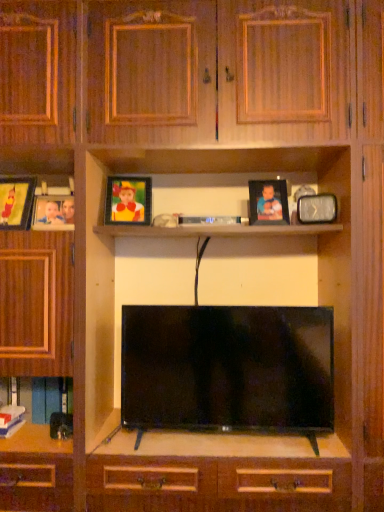
This screenshot has height=512, width=384. I want to click on blue paper book at lower left, which is counted as the 2th book, starting from the back, so click(x=11, y=420).

Where is `matte plastic picture frame at left, the second picture frame viewed from the left`? The image size is (384, 512). matte plastic picture frame at left, the second picture frame viewed from the left is located at coordinates (53, 213).

What do you see at coordinates (128, 200) in the screenshot?
I see `matte plastic picture frame at upper center, the 3th picture frame in the right-to-left sequence` at bounding box center [128, 200].

Find the location of a particular element. matte plastic picture frame at upper center, which appears as the third picture frame when viewed from the left is located at coordinates (128, 200).

Describe the element at coordinates (227, 368) in the screenshot. I see `black glossy flat-screen tv at center` at that location.

Where is `matte black picture frame at upper center, the fourth picture frame positioned from the left`? matte black picture frame at upper center, the fourth picture frame positioned from the left is located at coordinates (268, 202).

The height and width of the screenshot is (512, 384). What do you see at coordinates (268, 202) in the screenshot?
I see `matte black picture frame at upper center, positioned as the second picture frame in right-to-left order` at bounding box center [268, 202].

What are the coordinates of `blue paper book at lower left, which appears as the first book when viewed from the front` in the screenshot? It's located at (11, 420).

How different are the orientations of metallic rectangular clock at upper right, placed as the first picture frame when sorted from right to left, and matte plastic picture frame at upper center, which appears as the third picture frame when viewed from the left, in degrees?

The angle between the facing direction of metallic rectangular clock at upper right, placed as the first picture frame when sorted from right to left, and the facing direction of matte plastic picture frame at upper center, which appears as the third picture frame when viewed from the left, is 23.5 degrees.

Is the surface of metallic rectangular clock at upper right, acting as the 5th picture frame starting from the left, in direct contact with matte plastic picture frame at upper center, the 3th picture frame in the right-to-left sequence?

metallic rectangular clock at upper right, acting as the 5th picture frame starting from the left, and matte plastic picture frame at upper center, the 3th picture frame in the right-to-left sequence, are not in contact.

Between metallic rectangular clock at upper right, acting as the 5th picture frame starting from the left, and matte plastic picture frame at upper center, which appears as the third picture frame when viewed from the left, which one has larger width?

With larger width is matte plastic picture frame at upper center, which appears as the third picture frame when viewed from the left.

Does matte plastic picture frame at left, the second picture frame viewed from the left, appear on the left side of matte black picture frame at upper center, the fourth picture frame positioned from the left?

Indeed, matte plastic picture frame at left, the second picture frame viewed from the left, is positioned on the left side of matte black picture frame at upper center, the fourth picture frame positioned from the left.

Considering the relative sizes of matte plastic picture frame at left, the fourth picture frame when ordered from right to left, and matte black picture frame at upper center, the fourth picture frame positioned from the left, in the image provided, is matte plastic picture frame at left, the fourth picture frame when ordered from right to left, smaller than matte black picture frame at upper center, the fourth picture frame positioned from the left,?

→ Yes, matte plastic picture frame at left, the fourth picture frame when ordered from right to left, is smaller than matte black picture frame at upper center, the fourth picture frame positioned from the left.

From the image's perspective, is matte plastic picture frame at left, the second picture frame viewed from the left, on matte black picture frame at upper center, the fourth picture frame positioned from the left?

Incorrect, from the image's perspective, matte plastic picture frame at left, the second picture frame viewed from the left, is lower than matte black picture frame at upper center, the fourth picture frame positioned from the left.

How different are the orientations of matte plastic picture frame at left, the fourth picture frame when ordered from right to left, and matte black picture frame at upper center, the fourth picture frame positioned from the left, in degrees?

6.83 degrees separate the facing orientations of matte plastic picture frame at left, the fourth picture frame when ordered from right to left, and matte black picture frame at upper center, the fourth picture frame positioned from the left.

Could you measure the distance between hardcover book at lower left, positioned as the 2th book in front-to-back order, and matte plastic picture frame at upper center, which appears as the third picture frame when viewed from the left?

The distance of hardcover book at lower left, positioned as the 2th book in front-to-back order, from matte plastic picture frame at upper center, which appears as the third picture frame when viewed from the left, is 70.53 centimeters.

Consider the image. Does hardcover book at lower left, positioned as the 2th book in front-to-back order, have a lesser height compared to matte plastic picture frame at upper center, the 3th picture frame in the right-to-left sequence?

Yes.

Is hardcover book at lower left, positioned as the 2th book in front-to-back order, not near matte plastic picture frame at upper center, the 3th picture frame in the right-to-left sequence?

hardcover book at lower left, positioned as the 2th book in front-to-back order, is near matte plastic picture frame at upper center, the 3th picture frame in the right-to-left sequence, not far away.

From a real-world perspective, between hardcover book at lower left, positioned as the 2th book in front-to-back order, and matte plastic picture frame at upper center, the 3th picture frame in the right-to-left sequence, who is vertically lower?

hardcover book at lower left, positioned as the 2th book in front-to-back order.

Do you think matte wooden picture frame at left, arranged as the first picture frame when viewed from the left, is within matte plastic picture frame at upper center, which appears as the third picture frame when viewed from the left, or outside of it?

matte wooden picture frame at left, arranged as the first picture frame when viewed from the left, is spatially situated outside matte plastic picture frame at upper center, which appears as the third picture frame when viewed from the left.

Considering the sizes of objects matte wooden picture frame at left, the fifth picture frame in the right-to-left sequence, and matte plastic picture frame at upper center, which appears as the third picture frame when viewed from the left, in the image provided, who is taller, matte wooden picture frame at left, the fifth picture frame in the right-to-left sequence, or matte plastic picture frame at upper center, which appears as the third picture frame when viewed from the left,?

matte wooden picture frame at left, the fifth picture frame in the right-to-left sequence.

Is matte wooden picture frame at left, arranged as the first picture frame when viewed from the left, facing away from matte plastic picture frame at upper center, the 3th picture frame in the right-to-left sequence?

No, matte wooden picture frame at left, arranged as the first picture frame when viewed from the left,'s orientation is not away from matte plastic picture frame at upper center, the 3th picture frame in the right-to-left sequence.

Is there a large distance between matte wooden picture frame at left, arranged as the first picture frame when viewed from the left, and matte plastic picture frame at upper center, which appears as the third picture frame when viewed from the left?

No, matte wooden picture frame at left, arranged as the first picture frame when viewed from the left, is not far from matte plastic picture frame at upper center, which appears as the third picture frame when viewed from the left.

From the picture: How distant is matte plastic picture frame at upper center, which appears as the third picture frame when viewed from the left, from hardcover book at lower left, positioned as the 2th book in front-to-back order?

The distance of matte plastic picture frame at upper center, which appears as the third picture frame when viewed from the left, from hardcover book at lower left, positioned as the 2th book in front-to-back order, is 27.77 inches.

Considering the positions of objects matte plastic picture frame at upper center, which appears as the third picture frame when viewed from the left, and hardcover book at lower left, the 1th book when ordered from back to front, in the image provided, who is more to the left, matte plastic picture frame at upper center, which appears as the third picture frame when viewed from the left, or hardcover book at lower left, the 1th book when ordered from back to front,?

hardcover book at lower left, the 1th book when ordered from back to front.

From the picture: Does matte plastic picture frame at upper center, the 3th picture frame in the right-to-left sequence, turn towards hardcover book at lower left, positioned as the 2th book in front-to-back order?

No, matte plastic picture frame at upper center, the 3th picture frame in the right-to-left sequence, is not oriented towards hardcover book at lower left, positioned as the 2th book in front-to-back order.

This screenshot has height=512, width=384. I want to click on the 1st picture frame in front of the hardcover book at lower left, positioned as the 2th book in front-to-back order, counting from the anchor's position, so click(x=128, y=200).

Is blue paper book at lower left, which appears as the first book when viewed from the front, bigger than black glossy flat-screen tv at center?

No.

From a real-world perspective, between blue paper book at lower left, which appears as the first book when viewed from the front, and black glossy flat-screen tv at center, who is vertically lower?

blue paper book at lower left, which appears as the first book when viewed from the front, from a real-world perspective.

Which point is more distant from viewer, [18,426] or [303,380]?

The point [18,426] is more distant.

Is blue paper book at lower left, which appears as the first book when viewed from the front, positioned with its back to black glossy flat-screen tv at center?

blue paper book at lower left, which appears as the first book when viewed from the front, does not have its back to black glossy flat-screen tv at center.

Considering the points (284, 393) and (10, 425), which point is in front, point (284, 393) or point (10, 425)?

The point (284, 393) is more forward.

From the picture: From the image's perspective, is black glossy flat-screen tv at center on blue paper book at lower left, which appears as the first book when viewed from the front?

Yes, from the image's perspective, black glossy flat-screen tv at center is above blue paper book at lower left, which appears as the first book when viewed from the front.

The width and height of the screenshot is (384, 512). I want to click on the 2nd book below the black glossy flat-screen tv at center (from a real-world perspective), so click(11, 420).

Considering the relative positions of black glossy flat-screen tv at center and blue paper book at lower left, which appears as the first book when viewed from the front, in the image provided, is black glossy flat-screen tv at center to the left of blue paper book at lower left, which appears as the first book when viewed from the front, from the viewer's perspective?

No, black glossy flat-screen tv at center is not to the left of blue paper book at lower left, which appears as the first book when viewed from the front.

Locate an element on the screen. the 3rd picture frame above when counting from the metallic rectangular clock at upper right, acting as the 5th picture frame starting from the left (from the image's perspective) is located at coordinates (128, 200).

This screenshot has width=384, height=512. I want to click on the 1st picture frame in front when counting from the matte plastic picture frame at left, the second picture frame viewed from the left, so click(268, 202).

Based on their spatial positions, is hardcover book at lower left, positioned as the 2th book in front-to-back order, or matte plastic picture frame at upper center, the 3th picture frame in the right-to-left sequence, further from blue paper book at lower left, which is counted as the 2th book, starting from the back?

matte plastic picture frame at upper center, the 3th picture frame in the right-to-left sequence, is further to blue paper book at lower left, which is counted as the 2th book, starting from the back.

When comparing their distances from matte black picture frame at upper center, positioned as the second picture frame in right-to-left order, does matte wooden picture frame at left, arranged as the first picture frame when viewed from the left, or matte plastic picture frame at upper center, which appears as the third picture frame when viewed from the left, seem further?

The object further to matte black picture frame at upper center, positioned as the second picture frame in right-to-left order, is matte wooden picture frame at left, arranged as the first picture frame when viewed from the left.

Which object lies nearer to the anchor point matte black picture frame at upper center, positioned as the second picture frame in right-to-left order, matte plastic picture frame at left, the fourth picture frame when ordered from right to left, or matte wooden picture frame at left, arranged as the first picture frame when viewed from the left?

matte plastic picture frame at left, the fourth picture frame when ordered from right to left, is closer to matte black picture frame at upper center, positioned as the second picture frame in right-to-left order.

Which object lies nearer to the anchor point matte wooden picture frame at left, arranged as the first picture frame when viewed from the left, black glossy flat-screen tv at center or blue paper book at lower left, which is counted as the 2th book, starting from the back?

blue paper book at lower left, which is counted as the 2th book, starting from the back, is positioned closer to the anchor matte wooden picture frame at left, arranged as the first picture frame when viewed from the left.

From the image, which object appears to be nearer to matte plastic picture frame at upper center, the 3th picture frame in the right-to-left sequence, metallic rectangular clock at upper right, acting as the 5th picture frame starting from the left, or matte black picture frame at upper center, positioned as the second picture frame in right-to-left order?

matte black picture frame at upper center, positioned as the second picture frame in right-to-left order, lies closer to matte plastic picture frame at upper center, the 3th picture frame in the right-to-left sequence, than the other object.

When comparing their distances from blue paper book at lower left, which appears as the first book when viewed from the front, does metallic rectangular clock at upper right, acting as the 5th picture frame starting from the left, or matte plastic picture frame at upper center, which appears as the third picture frame when viewed from the left, seem further?

metallic rectangular clock at upper right, acting as the 5th picture frame starting from the left, is positioned further to the anchor blue paper book at lower left, which appears as the first book when viewed from the front.

Considering their positions, is matte wooden picture frame at left, the fifth picture frame in the right-to-left sequence, positioned closer to matte plastic picture frame at upper center, the 3th picture frame in the right-to-left sequence, than matte black picture frame at upper center, the fourth picture frame positioned from the left?

matte wooden picture frame at left, the fifth picture frame in the right-to-left sequence, is positioned closer to the anchor matte plastic picture frame at upper center, the 3th picture frame in the right-to-left sequence.

Considering their positions, is matte black picture frame at upper center, the fourth picture frame positioned from the left, positioned closer to hardcover book at lower left, the 1th book when ordered from back to front, than matte plastic picture frame at left, the fourth picture frame when ordered from right to left?

matte plastic picture frame at left, the fourth picture frame when ordered from right to left, lies closer to hardcover book at lower left, the 1th book when ordered from back to front, than the other object.

Locate an element on the screen. television located between blue paper book at lower left, which is counted as the 2th book, starting from the back, and matte black picture frame at upper center, positioned as the second picture frame in right-to-left order, in the left-right direction is located at coordinates (227, 368).

At what (x,y) coordinates should I click in order to perform the action: click on picture frame between matte plastic picture frame at left, the second picture frame viewed from the left, and matte black picture frame at upper center, the fourth picture frame positioned from the left. Please return your answer as a coordinate pair (x, y). The height and width of the screenshot is (512, 384). Looking at the image, I should click on (128, 200).

Locate an element on the screen. The height and width of the screenshot is (512, 384). television located between matte plastic picture frame at left, the second picture frame viewed from the left, and matte black picture frame at upper center, the fourth picture frame positioned from the left, in the left-right direction is located at coordinates (227, 368).

Where is `picture frame situated between matte wooden picture frame at left, the fifth picture frame in the right-to-left sequence, and matte plastic picture frame at upper center, the 3th picture frame in the right-to-left sequence, from left to right`? The height and width of the screenshot is (512, 384). picture frame situated between matte wooden picture frame at left, the fifth picture frame in the right-to-left sequence, and matte plastic picture frame at upper center, the 3th picture frame in the right-to-left sequence, from left to right is located at coordinates (53, 213).